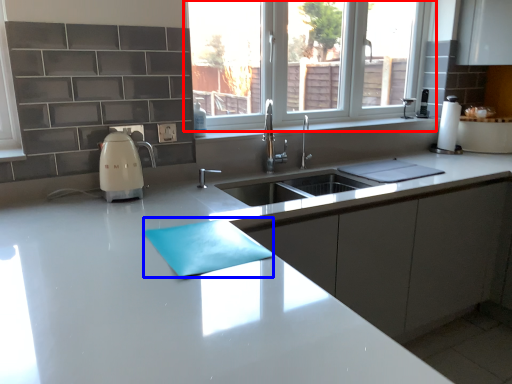
Question: Which object appears closest to the camera in this image, window (highlighted by a red box) or place mat (highlighted by a blue box)?

Choices:
 (A) window
 (B) place mat

Answer: (B)